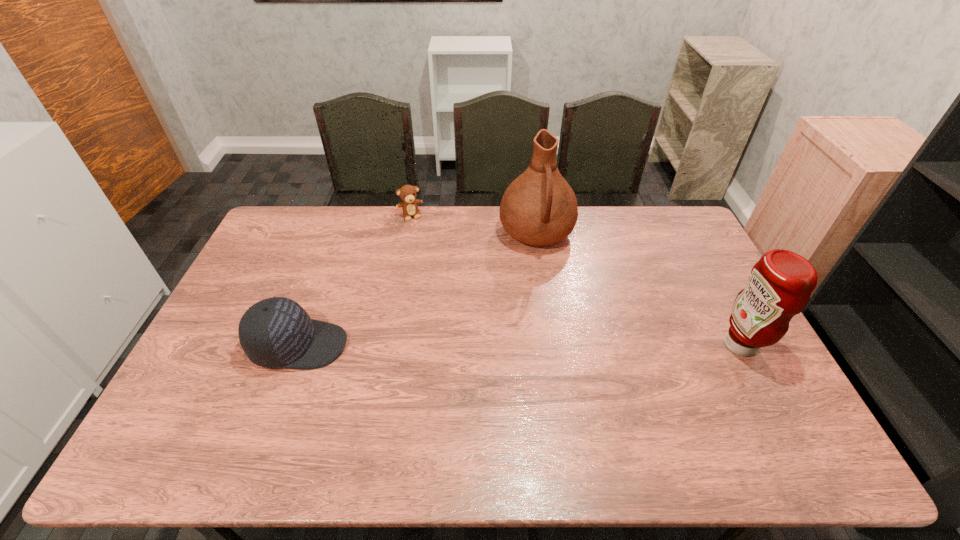
This screenshot has width=960, height=540. I want to click on the third tallest object, so click(x=276, y=332).

Locate an element on the screen. The width and height of the screenshot is (960, 540). baseball cap is located at coordinates (276, 332).

Image resolution: width=960 pixels, height=540 pixels. Find the location of `condiment`. condiment is located at coordinates (780, 284).

Identify the location of the rightmost object. This screenshot has width=960, height=540. (780, 284).

You are a GUI agent. You are given a task and a screenshot of the screen. Output one action in this format:
    pyautogui.click(x=<x>, y=<y>)
    Task: Click on the shortest object
    The image size is (960, 540).
    Given the screenshot: What is the action you would take?
    pyautogui.click(x=407, y=193)

Find the location of a particular element. The height and width of the screenshot is (540, 960). the second object from left to right is located at coordinates (407, 193).

In order to click on the tallest object in this screenshot , I will do `click(539, 208)`.

Locate an element on the screen. pitcher is located at coordinates (539, 208).

This screenshot has height=540, width=960. What are the coordinates of `free region located 0.120m at the front of the baseball cap where the brim is located` in the screenshot? It's located at tap(389, 345).

Locate an element on the screen. blank space located on the left of the condiment is located at coordinates (609, 345).